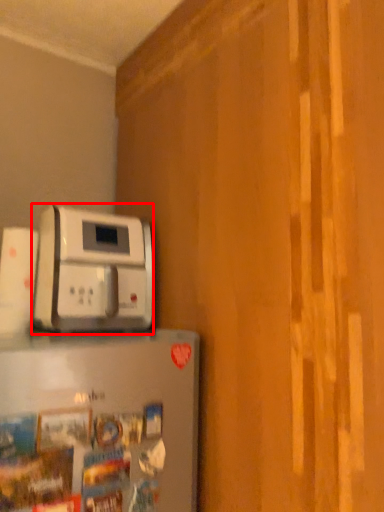
Question: From the image's perspective, what is the correct spatial relationship of home appliance (annotated by the red box) in relation to home appliance?

Choices:
 (A) above
 (B) below

Answer: (A)